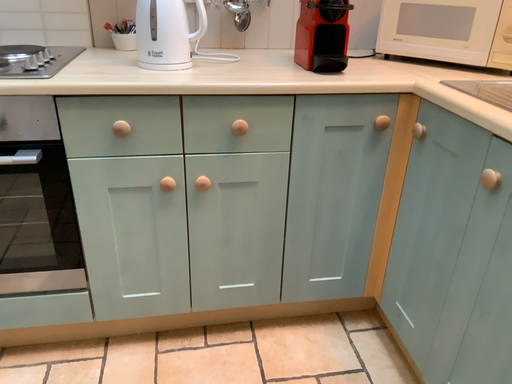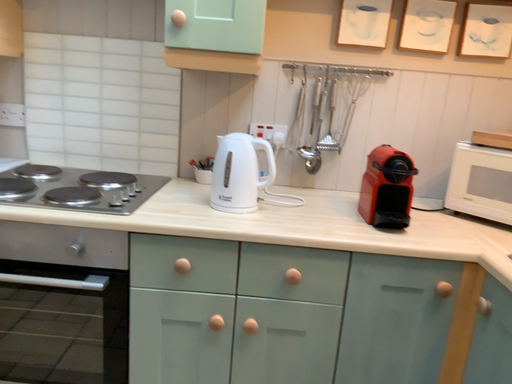
Question: Which way did the camera rotate in the video?

Choices:
 (A) rotated right
 (B) rotated left

Answer: (B)